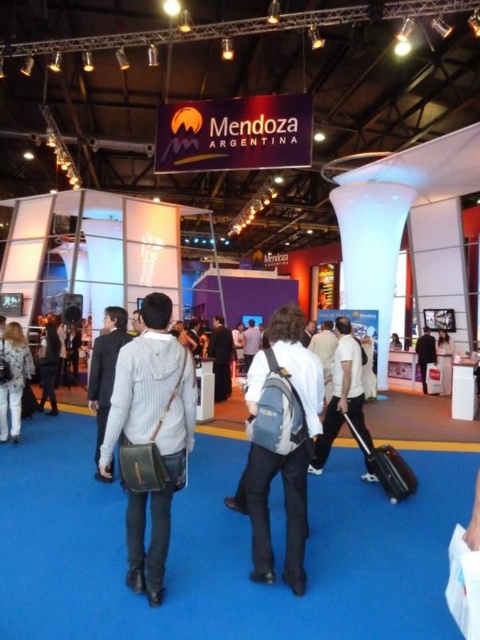
Is white matte backpack at center positioned in front of dark gray suit at center?

No, it is behind dark gray suit at center.

The width and height of the screenshot is (480, 640). What are the coordinates of `white matte backpack at center` in the screenshot? It's located at (343, 394).

Does dark gray suit at center have a greater width compared to denim jacket at lower left?

Yes, dark gray suit at center is wider than denim jacket at lower left.

Does dark gray suit at center come behind denim jacket at lower left?

No.

Does point (121, 332) come closer to viewer compared to point (26, 360)?

Yes.

At what (x,y) coordinates should I click in order to perform the action: click on dark gray suit at center. Please return your answer as a coordinate pair (x, y). Image resolution: width=480 pixels, height=640 pixels. Looking at the image, I should click on (105, 371).

Who is positioned more to the left, white matte backpack at center or denim jacket at lower left?

denim jacket at lower left is more to the left.

Who is positioned more to the right, white matte backpack at center or denim jacket at lower left?

From the viewer's perspective, white matte backpack at center appears more on the right side.

The image size is (480, 640). What do you see at coordinates (343, 394) in the screenshot? I see `white matte backpack at center` at bounding box center [343, 394].

You are a GUI agent. You are given a task and a screenshot of the screen. Output one action in this format:
    pyautogui.click(x=<x>, y=<y>)
    Task: Click on the white matte backpack at center
    Image resolution: width=480 pixels, height=640 pixels.
    Given the screenshot: What is the action you would take?
    pyautogui.click(x=343, y=394)